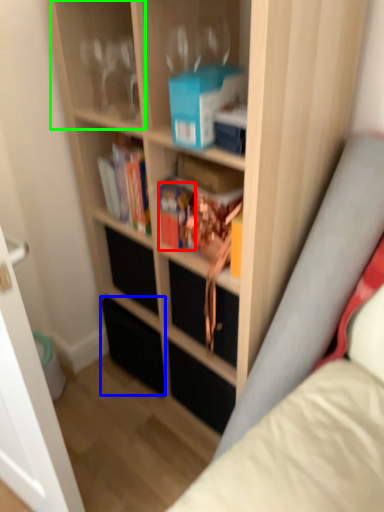
Question: Which is nearer to the book (highlighted by a red box)? drawer (highlighted by a blue box) or shelf (highlighted by a green box).

Choices:
 (A) drawer
 (B) shelf

Answer: (B)